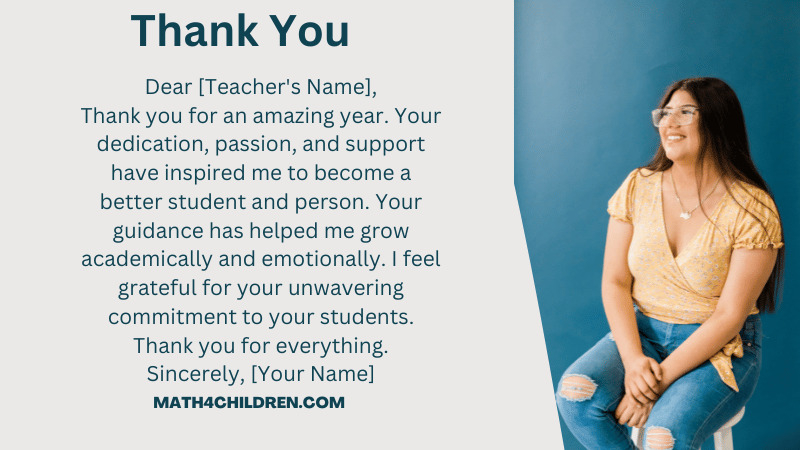
Image resolution: width=800 pixels, height=450 pixels. In order to click on stool in this screenshot , I will do `click(726, 438)`.